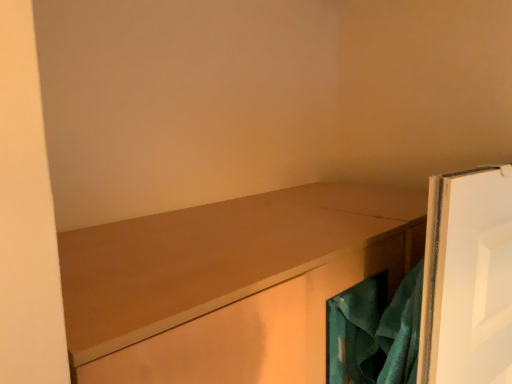
Question: Is the position of teal fabric at right more distant than that of matte wood cabinet at center?

Choices:
 (A) no
 (B) yes

Answer: (B)

Question: Can you confirm if teal fabric at right is smaller than matte wood cabinet at center?

Choices:
 (A) yes
 (B) no

Answer: (A)

Question: From a real-world perspective, is teal fabric at right physically below matte wood cabinet at center?

Choices:
 (A) yes
 (B) no

Answer: (B)

Question: Is teal fabric at right turned away from matte wood cabinet at center?

Choices:
 (A) no
 (B) yes

Answer: (B)

Question: Can you confirm if teal fabric at right is wider than matte wood cabinet at center?

Choices:
 (A) no
 (B) yes

Answer: (A)

Question: From the image's perspective, is teal fabric at right above matte wood cabinet at center?

Choices:
 (A) no
 (B) yes

Answer: (B)

Question: From the image's perspective, is matte wood cabinet at center located above teal fabric at right?

Choices:
 (A) no
 (B) yes

Answer: (A)

Question: Is matte wood cabinet at center located outside teal fabric at right?

Choices:
 (A) yes
 (B) no

Answer: (A)

Question: Does matte wood cabinet at center have a lesser width compared to teal fabric at right?

Choices:
 (A) no
 (B) yes

Answer: (A)

Question: From the image's perspective, is matte wood cabinet at center located beneath teal fabric at right?

Choices:
 (A) yes
 (B) no

Answer: (A)

Question: Can you confirm if matte wood cabinet at center is smaller than teal fabric at right?

Choices:
 (A) no
 (B) yes

Answer: (A)

Question: Is matte wood cabinet at center placed right next to teal fabric at right?

Choices:
 (A) no
 (B) yes

Answer: (A)

Question: In terms of height, does teal fabric at right look taller or shorter compared to matte wood cabinet at center?

Choices:
 (A) tall
 (B) short

Answer: (B)